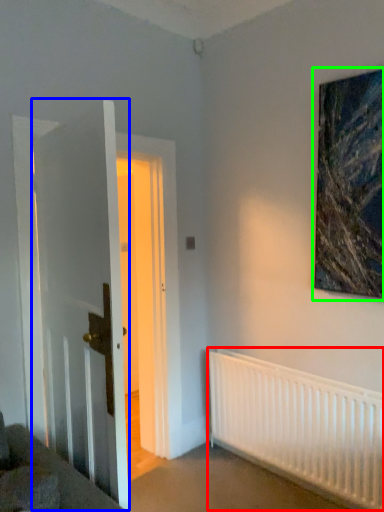
Question: Based on their relative distances, which object is nearer to radiator (highlighted by a red box)? Choose from door (highlighted by a blue box) and picture frame (highlighted by a green box).

Choices:
 (A) door
 (B) picture frame

Answer: (B)